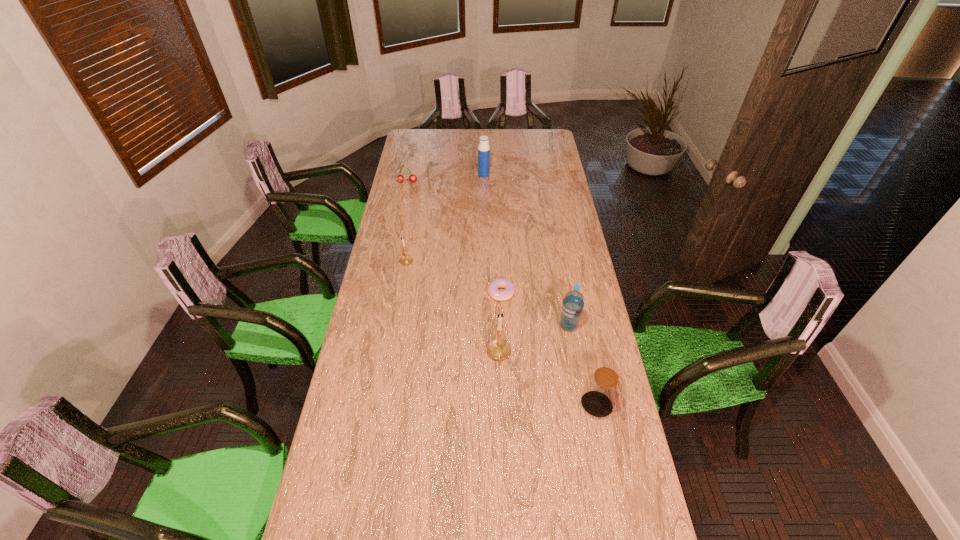
Find the location of a particular element. The height and width of the screenshot is (540, 960). vacant region located on the front of the right water bottle is located at coordinates (584, 413).

Image resolution: width=960 pixels, height=540 pixels. In order to click on vacant space located 0.060m on the front of the fourth farthest object in this screenshot , I will do `click(502, 314)`.

Find the location of `free space located on the back of the fourth shortest object`. free space located on the back of the fourth shortest object is located at coordinates (585, 345).

Where is `candle holder present at the left edge`? candle holder present at the left edge is located at coordinates (406, 259).

Locate an element on the screen. cherry present at the left edge is located at coordinates (400, 178).

Where is `water bottle positioned at the right edge`? The width and height of the screenshot is (960, 540). water bottle positioned at the right edge is located at coordinates (572, 307).

Where is `jar located at the right edge`? This screenshot has height=540, width=960. jar located at the right edge is located at coordinates (602, 388).

Locate an element on the screen. free space at the far edge is located at coordinates (452, 133).

Identify the location of blank space at the left edge of the desktop. (373, 263).

At what (x,y) coordinates should I click in order to perform the action: click on vacant point at the right edge. Please return your answer as a coordinate pair (x, y). Image resolution: width=960 pixels, height=540 pixels. Looking at the image, I should click on (578, 242).